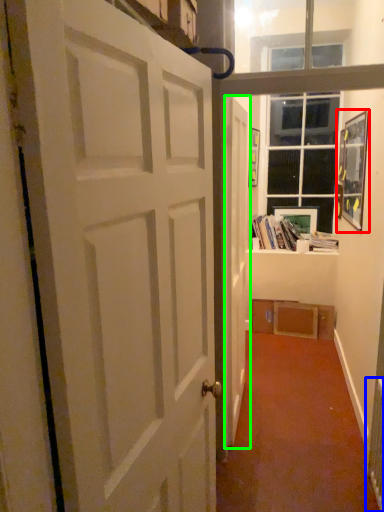
Question: Which object is positioned closest to picture frame (highlighted by a red box)? Select from radiator (highlighted by a blue box) and door (highlighted by a green box).

Choices:
 (A) radiator
 (B) door

Answer: (B)